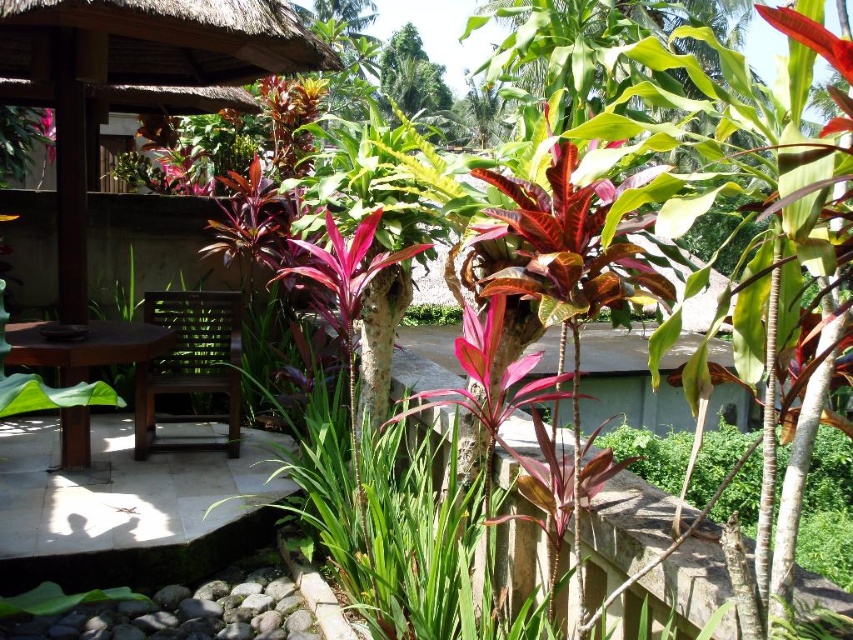
Question: Which point is farther to the camera?

Choices:
 (A) brown wooden table at lower left
 (B) brown wooden chair at center

Answer: (B)

Question: Is brown wooden chair at center bigger than brown wooden table at lower left?

Choices:
 (A) yes
 (B) no

Answer: (B)

Question: Where is brown wooden chair at center located in relation to brown wooden table at lower left in the image?

Choices:
 (A) below
 (B) above

Answer: (A)

Question: Which of the following is the farthest from the observer?

Choices:
 (A) brown wooden table at lower left
 (B) brown wooden chair at center

Answer: (B)

Question: Does brown wooden chair at center appear on the right side of brown wooden table at lower left?

Choices:
 (A) yes
 (B) no

Answer: (A)